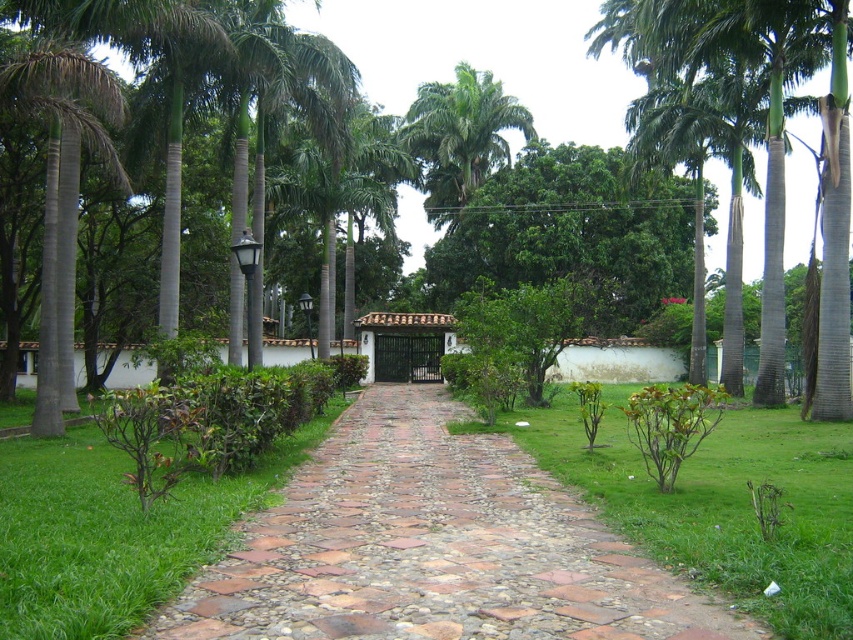
You are a gardener who needs to mow the green grass at center and trim the green leafy palm tree at upper center. Which task should you tackle first if you want to start with the shorter plant?

You should mow the green grass at center first because it is shorter than the green leafy palm tree at upper center.

Based on the photo, you are a gardener planning to water the green grass at center and the green leafy palm tree at upper center. Which one should you water first if you want to start from the lower part of the scene?

You should water the green grass at center first because it is located below the green leafy palm tree at upper center, so starting from the lower part means beginning with the grass.